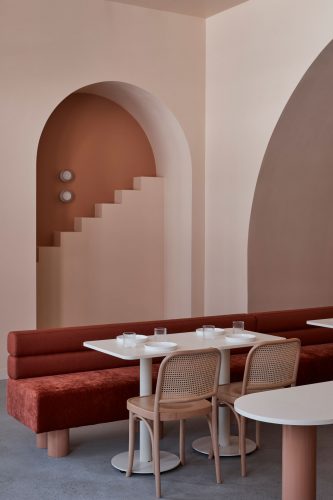
This screenshot has height=500, width=333. I want to click on plate, so click(x=163, y=347).